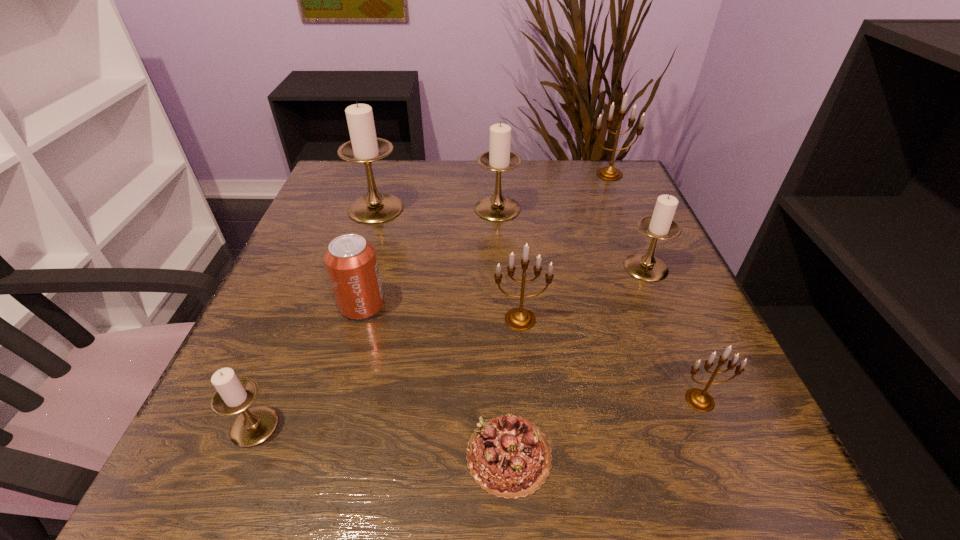
At what (x,y) coordinates should I click in order to perform the action: click on the smallest gold candelabrum. Please return your answer as a coordinate pair (x, y). Looking at the image, I should click on (699, 399).

Where is `the nearest white candle holder`? the nearest white candle holder is located at coordinates (234, 395).

Where is `chocolate cake`? This screenshot has width=960, height=540. chocolate cake is located at coordinates (509, 457).

You are a GUI agent. You are given a task and a screenshot of the screen. Output one action in this format:
    pyautogui.click(x=<x>, y=<y>)
    Task: Click on the free location located 0.210m on the front of the tallest object
    
    Given the screenshot: What is the action you would take?
    pyautogui.click(x=350, y=289)

Identify the location of vacant space located 0.200m on the front of the farthest candle holder. Image resolution: width=960 pixels, height=540 pixels. (633, 226).

This screenshot has height=540, width=960. Identify the location of free spot located 0.260m on the front of the second white candle holder from right to left. (503, 305).

Where is `free space located on the right of the leftmost gold candelabrum`? Image resolution: width=960 pixels, height=540 pixels. free space located on the right of the leftmost gold candelabrum is located at coordinates (702, 319).

Find the location of `free spot located on the back of the third biggest white candle holder`. free spot located on the back of the third biggest white candle holder is located at coordinates (613, 190).

Locate an element on the screen. vacant space located 0.090m on the right of the orange can is located at coordinates (435, 305).

Identify the location of vacant space situated on the back of the nearest gold candelabrum. (647, 274).